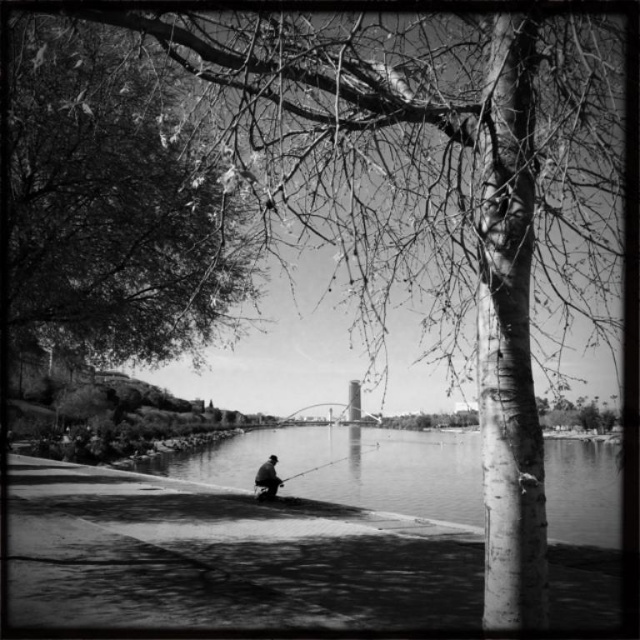
Question: Considering the real-world distances, which object is farthest from the dark gray fabric fisherman at center?

Choices:
 (A) smooth water at lower center
 (B) smooth metallic fishing pole at center

Answer: (A)

Question: Which point is closer to the camera taking this photo?

Choices:
 (A) (268, 460)
 (B) (118, 109)
 (C) (365, 435)

Answer: (B)

Question: Which object appears farthest from the camera in this image?

Choices:
 (A) smooth bark tree at upper left
 (B) smooth water at lower center
 (C) smooth metallic fishing pole at center

Answer: (C)

Question: Can you confirm if dark gray fabric fisherman at center is positioned above smooth metallic fishing pole at center?

Choices:
 (A) yes
 (B) no

Answer: (A)

Question: Is dark gray fabric fisherman at center above smooth metallic fishing pole at center?

Choices:
 (A) yes
 (B) no

Answer: (A)

Question: Does dark gray fabric fisherman at center have a lesser width compared to smooth metallic fishing pole at center?

Choices:
 (A) no
 (B) yes

Answer: (B)